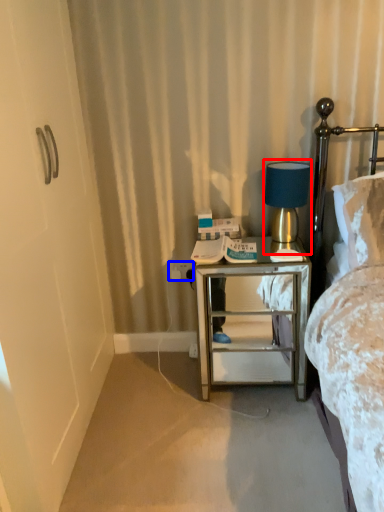
Question: Which point is closer to the camera, table lamp (highlighted by a red box) or electric outlet (highlighted by a blue box)?

Choices:
 (A) table lamp
 (B) electric outlet

Answer: (A)